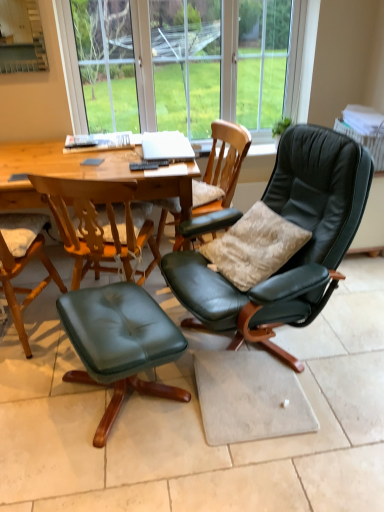
Question: From the image's perspective, is matte black leather chair at center, marked as the second chair in a right-to-left arrangement, positioned above or below velvet beige pillow at center right?

Choices:
 (A) above
 (B) below

Answer: (A)

Question: Which is correct: matte black leather chair at center, marked as the second chair in a right-to-left arrangement, is inside velvet beige pillow at center right, or outside of it?

Choices:
 (A) inside
 (B) outside

Answer: (B)

Question: Which object is the closest to the matte black leather chair at center, marked as the second chair in a right-to-left arrangement?

Choices:
 (A) green leather ottoman at lower left
 (B) wooden round table at center
 (C) matte green leather chair at lower left, acting as the 1th chair starting from the left
 (D) velvet beige pillow at center right
 (E) matte black leather chair at center, marked as the 3th chair in a left-to-right arrangement

Answer: (D)

Question: Considering the real-world distances, which object is closest to the transparent glass bay window at upper center?

Choices:
 (A) matte green leather chair at lower left, acting as the 1th chair starting from the left
 (B) wooden round table at center
 (C) matte black leather chair at center, marked as the second chair in a right-to-left arrangement
 (D) green leather ottoman at lower left
 (E) matte black leather chair at center, marked as the 3th chair in a left-to-right arrangement

Answer: (C)